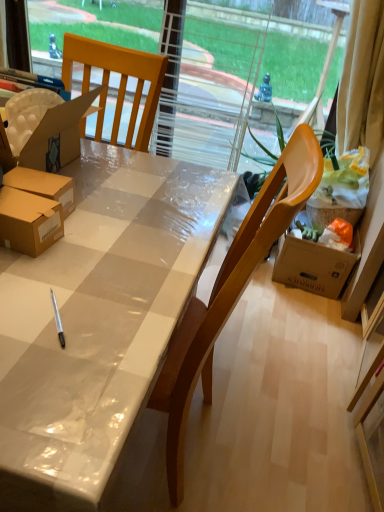
Locate an element on the screen. Image resolution: width=384 pixels, height=512 pixels. white glossy desk at center is located at coordinates (97, 320).

Describe the element at coordinates (97, 320) in the screenshot. This screenshot has width=384, height=512. I see `white glossy desk at center` at that location.

Where is `white glossy desk at center`? This screenshot has height=512, width=384. white glossy desk at center is located at coordinates 97,320.